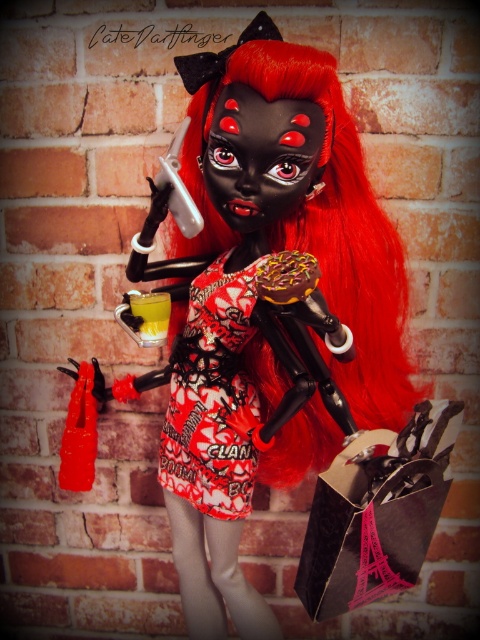
Question: Is printed fabric dress at center to the left of yellow translucent liquid at center from the viewer's perspective?

Choices:
 (A) yes
 (B) no

Answer: (B)

Question: Where is black paper shopping bag at lower right located in relation to printed fabric dress at center in the image?

Choices:
 (A) right
 (B) left

Answer: (A)

Question: Which point is closer to the camera taking this photo?

Choices:
 (A) (156, 337)
 (B) (432, 484)
 (C) (201, 301)

Answer: (B)

Question: Does black paper shopping bag at lower right have a lesser width compared to printed fabric dress at center?

Choices:
 (A) no
 (B) yes

Answer: (A)

Question: Which point appears farthest from the camera in this image?

Choices:
 (A) (136, 308)
 (B) (384, 586)
 (C) (227, 422)

Answer: (C)

Question: Which object appears closest to the camera in this image?

Choices:
 (A) printed fabric dress at center
 (B) yellow translucent liquid at center

Answer: (B)